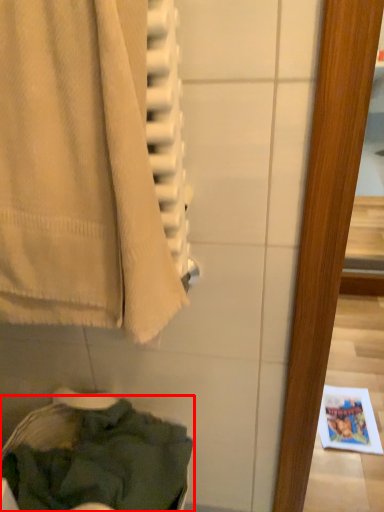
Question: From the image's perspective, what is the correct spatial positioning of clothing (annotated by the red box) in reference to towel?

Choices:
 (A) below
 (B) above

Answer: (A)